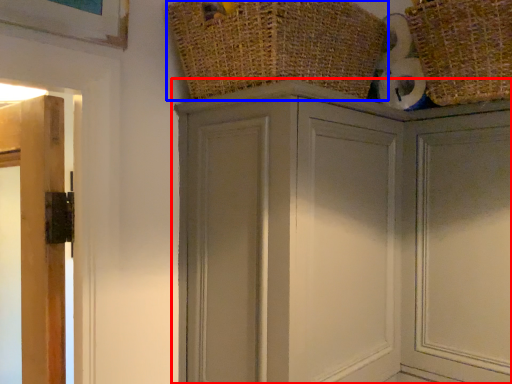
Question: Which object appears closest to the camera in this image, cupboard (highlighted by a red box) or basket (highlighted by a blue box)?

Choices:
 (A) cupboard
 (B) basket

Answer: (B)